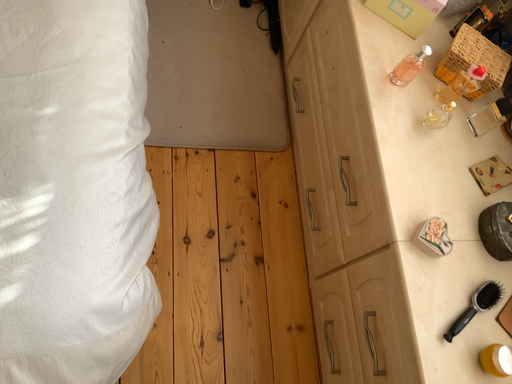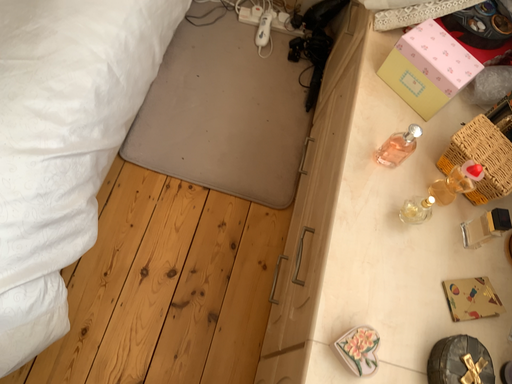
Question: How did the camera likely rotate when shooting the video?

Choices:
 (A) rotated right
 (B) rotated left

Answer: (B)